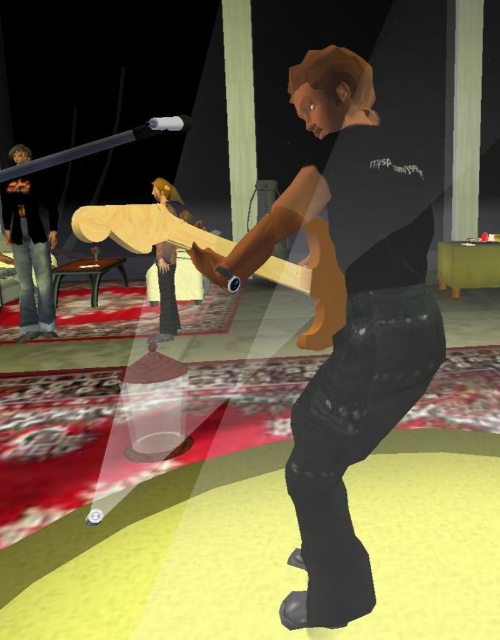
You are a game developer checking the character setup in the game. The character is wearing a brown matte shirt at center and has a wooden skateboard at center. Which item is located above the other?

The wooden skateboard at center is above the brown matte shirt at center because the brown matte shirt at center is positioned under it.